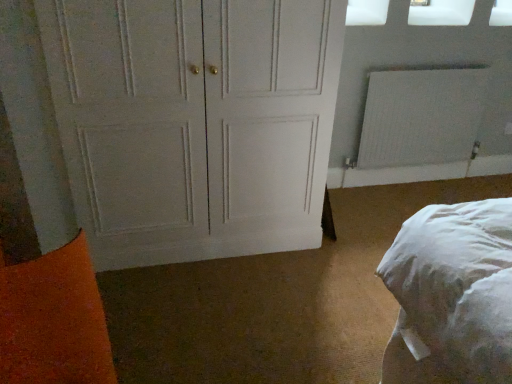
At what (x,y) coordinates should I click in order to perform the action: click on free point to the right of white painted wood door at center. Please return your answer as a coordinate pair (x, y). Looking at the image, I should click on (351, 243).